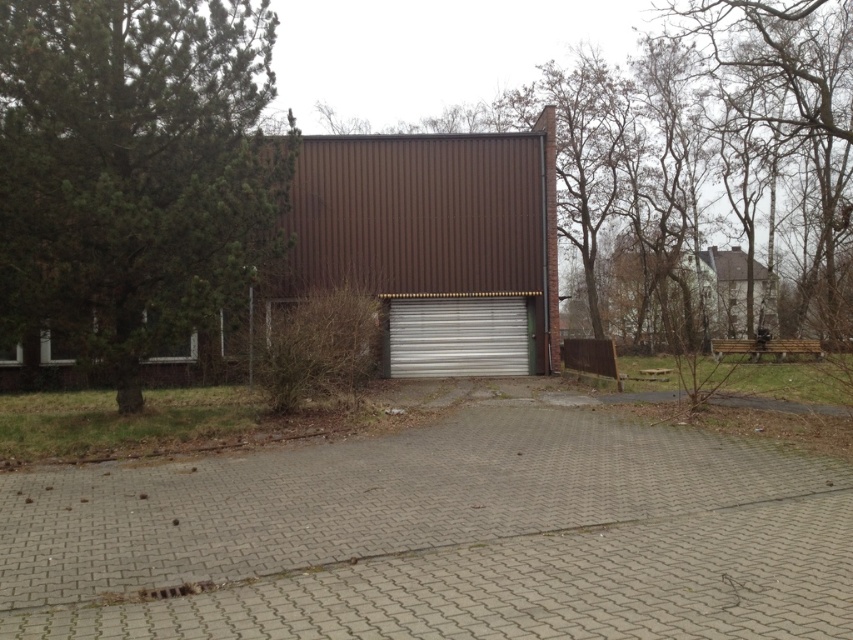
Question: Which object is the closest to the gray paving stones at center?

Choices:
 (A) green textured tree at left
 (B) brown corrugated metal garage at center
 (C) silver metallic garage door at center

Answer: (A)

Question: Is gray paving stones at center thinner than silver metallic garage door at center?

Choices:
 (A) no
 (B) yes

Answer: (A)

Question: Which point is closer to the camera?

Choices:
 (A) brown corrugated metal garage at center
 (B) green textured tree at left
 (C) silver metallic garage door at center

Answer: (B)

Question: Does green textured tree at left have a larger size compared to brown corrugated metal garage at center?

Choices:
 (A) yes
 (B) no

Answer: (B)

Question: Which point is farther from the camera taking this photo?

Choices:
 (A) (474, 317)
 (B) (257, 28)
 (C) (525, 216)
 (D) (212, 493)

Answer: (A)

Question: Can you confirm if brown corrugated metal garage at center is positioned to the left of silver metallic garage door at center?

Choices:
 (A) yes
 (B) no

Answer: (A)